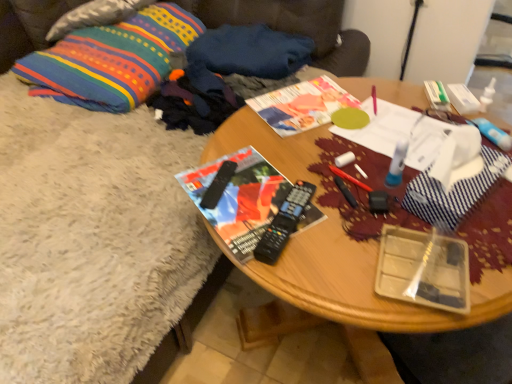
Question: Based on their sizes in the image, would you say dark blue fabric at upper center, the 1th clothing when ordered from back to front, is bigger or smaller than multicolored woven pillow at upper left, positioned as the 1th pillow in bottom-to-top order?

Choices:
 (A) big
 (B) small

Answer: (B)

Question: Relative to multicolored woven pillow at upper left, the second pillow from the top, is dark blue fabric at upper center, which is the second clothing in front-to-back order, in front or behind?

Choices:
 (A) front
 (B) behind

Answer: (B)

Question: Which object is the closest to the dark blue fleece socks at upper left, marked as the second clothing in a back-to-front arrangement?

Choices:
 (A) multicolored woven pillow at upper left, the second pillow from the top
 (B) black plastic remote control at center, the 1th remote control positioned from the left
 (C) dark blue fabric at upper center, the 1th clothing when ordered from back to front
 (D) matte paper magazine at center
 (E) wooden table at center

Answer: (C)

Question: Considering the real-world distances, which object is farthest from the multicolored woven pillow at upper left, positioned as the 1th pillow in bottom-to-top order?

Choices:
 (A) velvet fabric couch at upper left
 (B) matte black magazine at center
 (C) black plastic remote control at center, which is the 2th remote control in right-to-left order
 (D) dark blue fabric at upper center, the 1th clothing when ordered from back to front
 (E) textured cotton pillow at upper left, which is counted as the 2th pillow, starting from the bottom

Answer: (C)